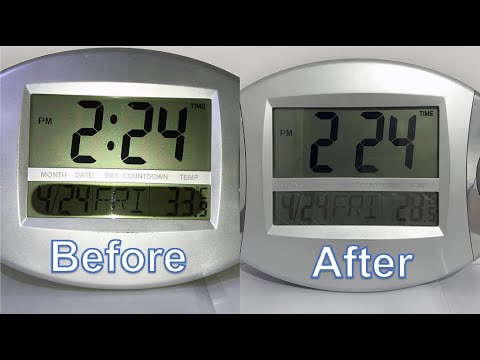
Where is `digital clock`? The image size is (480, 360). digital clock is located at coordinates [x=372, y=81], [x=149, y=64].